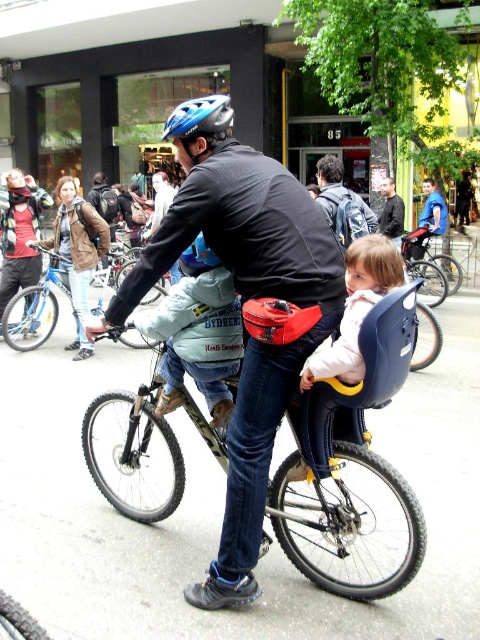
Question: Does black matte bicycle at center appear on the right side of blue fabric shirt at upper center?

Choices:
 (A) no
 (B) yes

Answer: (A)

Question: Which of these objects is positioned closest to the blue matte bicycle helmet at upper center?

Choices:
 (A) blue fabric shirt at upper center
 (B) denim jacket at center
 (C) matte black bicycle at center
 (D) dark gray jacket at center

Answer: (B)

Question: Among these objects, which one is farthest from the camera?

Choices:
 (A) blue fabric shirt at upper center
 (B) metallic silver bicycle at center

Answer: (A)

Question: Is light pink fabric jacket at center further to camera compared to blue fabric shirt at upper center?

Choices:
 (A) no
 (B) yes

Answer: (A)

Question: Considering the relative positions of matte black jacket at center and blue matte bicycle helmet at upper center in the image provided, where is matte black jacket at center located with respect to blue matte bicycle helmet at upper center?

Choices:
 (A) right
 (B) left

Answer: (A)

Question: Which is farther from the black matte bicycle at center?

Choices:
 (A) blue fabric shirt at upper center
 (B) denim jacket at center

Answer: (A)